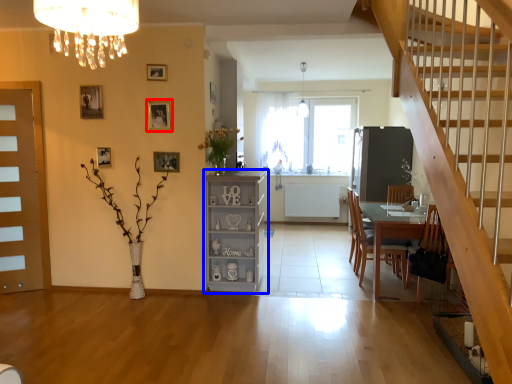
Question: Which of the following is the closest to the observer, picture frame (highlighted by a red box) or cabinetry (highlighted by a blue box)?

Choices:
 (A) picture frame
 (B) cabinetry

Answer: (A)